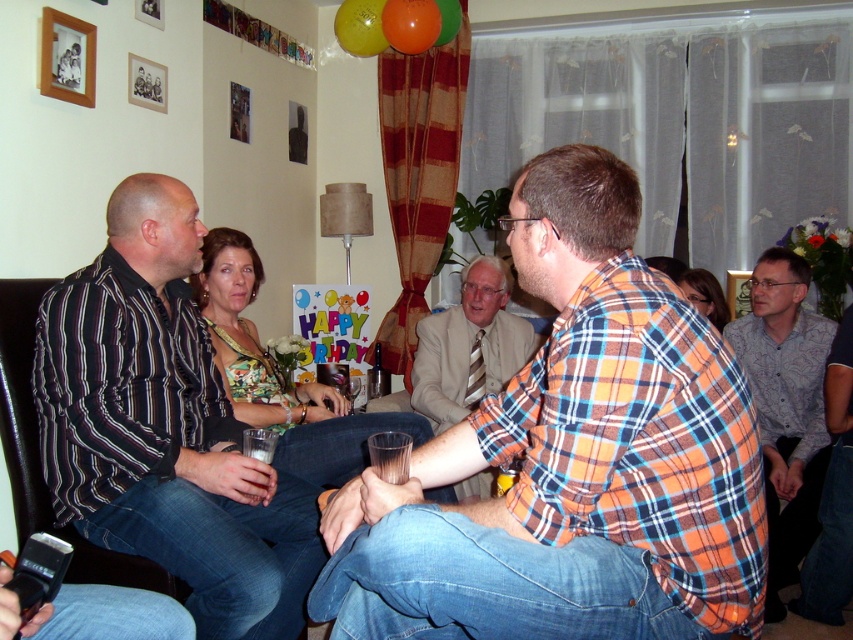
You are a photographer at the event and want to capture a group photo. The striped cotton shirt at left and the plaid flannel shirt at center are in your frame. Which shirt should you focus on if you want to highlight the wider one?

The striped cotton shirt at left is wider than the plaid flannel shirt at center, so focus on the striped cotton shirt at left to highlight the wider one.

You are a photographer at the birthday party and want to take a photo of the orange plaid shirt at center and the floral fabric dress at center. Which one is positioned lower in the image?

The orange plaid shirt at center is located below the floral fabric dress at center, so it is positioned lower in the image.